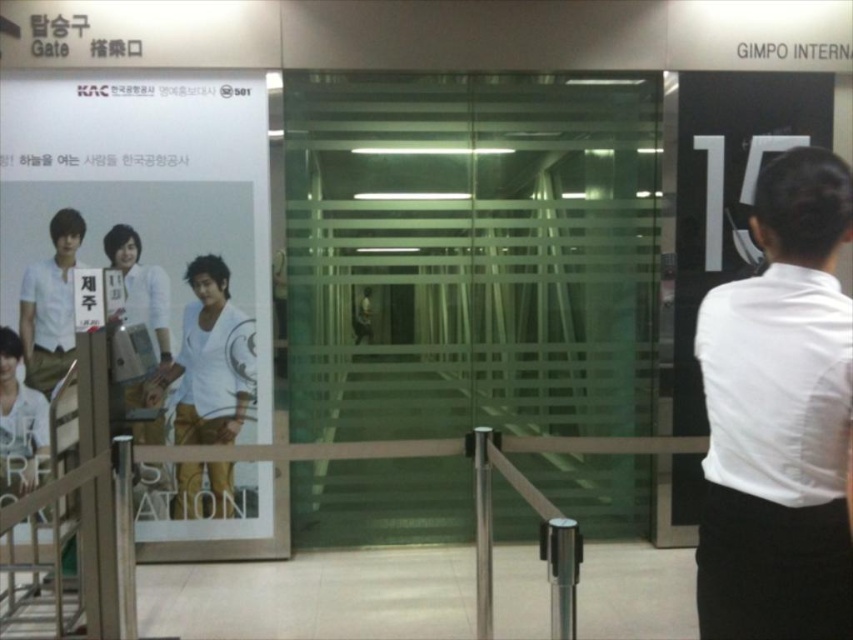
You are standing at the airport terminal and want to locate two points marked on the floor. The first point is at coordinate point [778,522] and the second is at point [193,291]. Which point is closer to you?

Point [778,522] is closer to the viewer than point [193,291].